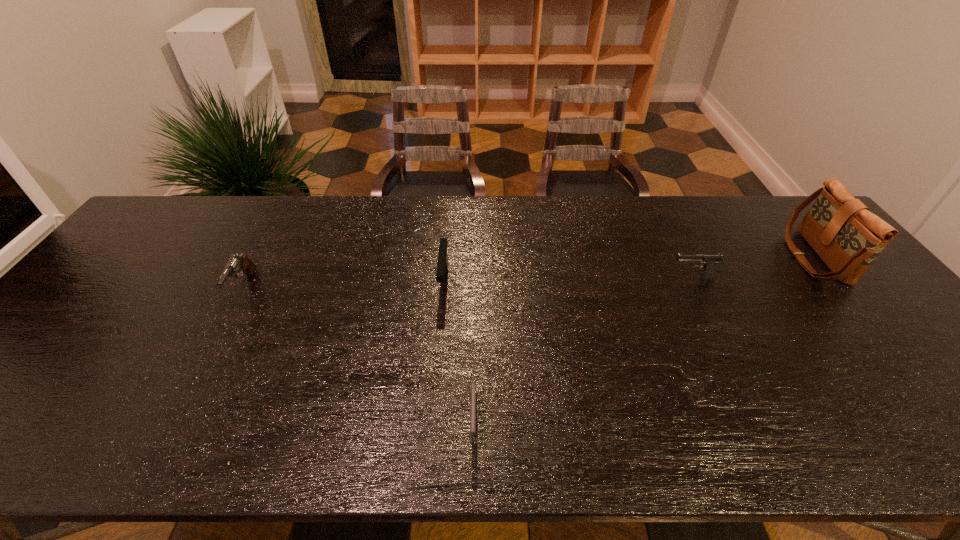
You are a GUI agent. You are given a task and a screenshot of the screen. Output one action in this format:
    pyautogui.click(x=<x>, y=<y>)
    Task: Click on the blank space located on the front-facing side of the fourth object from right to left
    
    Given the screenshot: What is the action you would take?
    pyautogui.click(x=431, y=435)

The image size is (960, 540). I want to click on vacant point located 0.200m at the barrel of the leftmost pistol, so click(x=198, y=372).

Locate an element on the screen. Image resolution: width=960 pixels, height=540 pixels. vacant position located 0.180m aim along the barrel of the fourth object from left to right is located at coordinates (607, 278).

Where is `vacant position located 0.160m aim along the barrel of the fourth object from left to right`? This screenshot has height=540, width=960. vacant position located 0.160m aim along the barrel of the fourth object from left to right is located at coordinates (613, 278).

Locate an element on the screen. This screenshot has width=960, height=540. vacant area situated aim along the barrel of the fourth object from left to right is located at coordinates (554, 278).

Locate an element on the screen. Image resolution: width=960 pixels, height=540 pixels. object located in the far edge section of the desktop is located at coordinates (843, 232).

Where is `object present at the near edge`? The width and height of the screenshot is (960, 540). object present at the near edge is located at coordinates (473, 397).

This screenshot has width=960, height=540. Identify the location of object that is at the right edge. click(x=843, y=232).

Locate an element on the screen. The image size is (960, 540). object that is positioned at the far right corner is located at coordinates (843, 232).

The image size is (960, 540). In the image, there is a desktop. What are the coordinates of `free region at the far edge` in the screenshot? It's located at (670, 206).